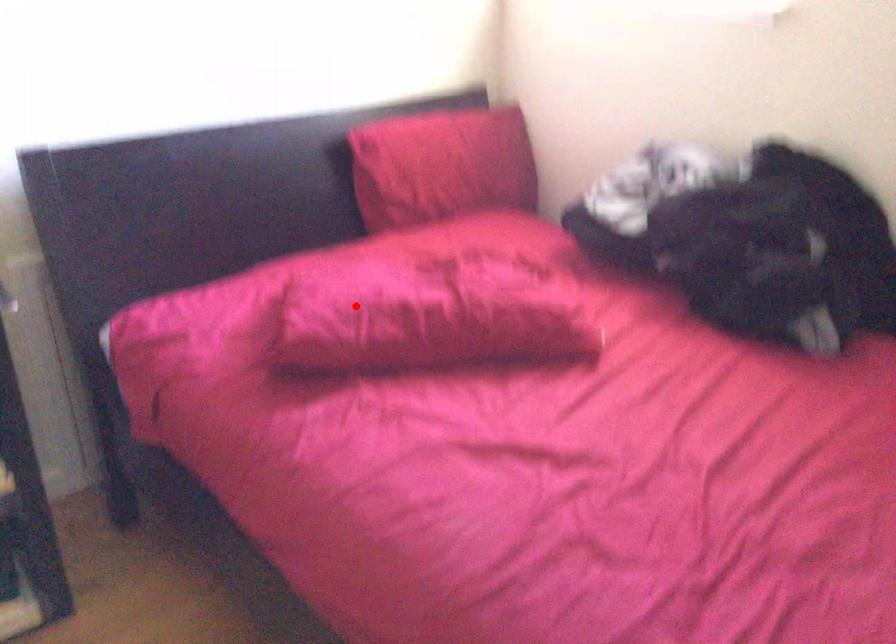
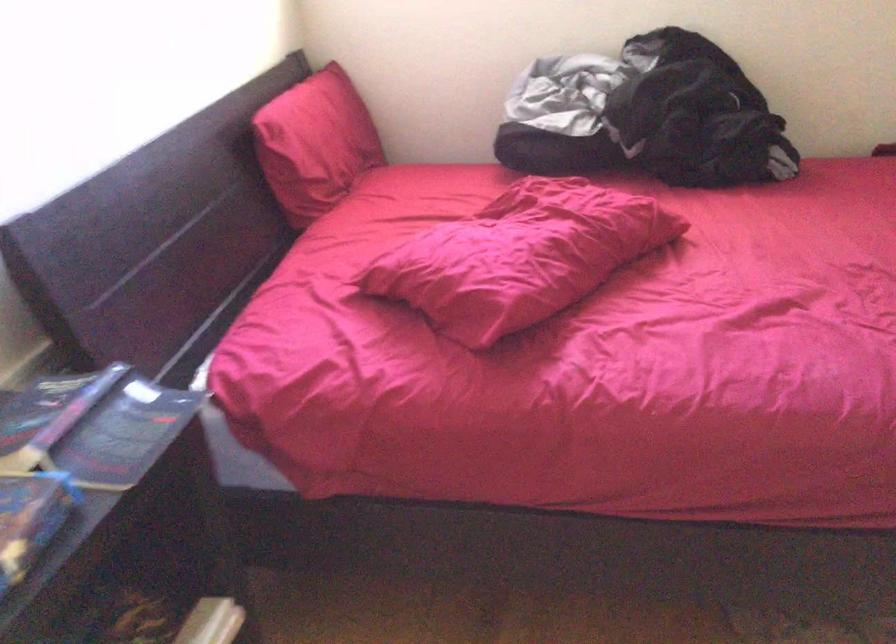
The point at the highlighted location is marked in the first image. Where is the corresponding point in the second image?

(520, 257)